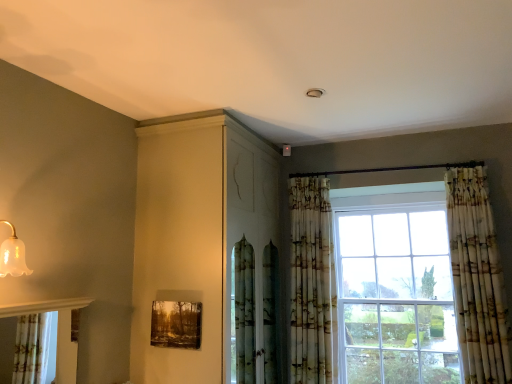
Question: Considering the relative positions of wooden textured frame at lower center and printed fabric curtain at right, which is the 2th curtain in left-to-right order, in the image provided, is wooden textured frame at lower center to the left of printed fabric curtain at right, which is the 2th curtain in left-to-right order, from the viewer's perspective?

Choices:
 (A) yes
 (B) no

Answer: (A)

Question: Is wooden textured frame at lower center placed right next to printed fabric curtain at right, which is the 2th curtain in left-to-right order?

Choices:
 (A) yes
 (B) no

Answer: (B)

Question: Does wooden textured frame at lower center have a larger size compared to printed fabric curtain at right, which is the 2th curtain in left-to-right order?

Choices:
 (A) no
 (B) yes

Answer: (A)

Question: Is wooden textured frame at lower center not near printed fabric curtain at right, positioned as the first curtain in right-to-left order?

Choices:
 (A) yes
 (B) no

Answer: (A)

Question: Is wooden textured frame at lower center at the right side of printed fabric curtain at right, positioned as the first curtain in right-to-left order?

Choices:
 (A) no
 (B) yes

Answer: (A)

Question: Is printed fabric curtain at center, the 1th curtain positioned from the left, situated inside wooden textured frame at lower center or outside?

Choices:
 (A) inside
 (B) outside

Answer: (B)

Question: In the image, is printed fabric curtain at center, the 1th curtain positioned from the left, positioned in front of or behind wooden textured frame at lower center?

Choices:
 (A) front
 (B) behind

Answer: (B)

Question: Considering the relative positions of printed fabric curtain at center, the second curtain positioned from the right, and wooden textured frame at lower center in the image provided, is printed fabric curtain at center, the second curtain positioned from the right, to the left or to the right of wooden textured frame at lower center?

Choices:
 (A) right
 (B) left

Answer: (A)

Question: From the image's perspective, is printed fabric curtain at center, the 1th curtain positioned from the left, located above or below wooden textured frame at lower center?

Choices:
 (A) below
 (B) above

Answer: (B)

Question: Is printed fabric curtain at center, the 1th curtain positioned from the left, inside the boundaries of printed fabric curtain at right, which is the 2th curtain in left-to-right order, or outside?

Choices:
 (A) inside
 (B) outside

Answer: (B)

Question: Considering the positions of printed fabric curtain at center, the 1th curtain positioned from the left, and printed fabric curtain at right, positioned as the first curtain in right-to-left order, in the image, is printed fabric curtain at center, the 1th curtain positioned from the left, wider or thinner than printed fabric curtain at right, positioned as the first curtain in right-to-left order,?

Choices:
 (A) thin
 (B) wide

Answer: (A)

Question: From a real-world perspective, is printed fabric curtain at center, the 1th curtain positioned from the left, physically located above or below printed fabric curtain at right, positioned as the first curtain in right-to-left order?

Choices:
 (A) below
 (B) above

Answer: (A)

Question: From the image's perspective, is printed fabric curtain at center, the 1th curtain positioned from the left, above or below printed fabric curtain at right, which is the 2th curtain in left-to-right order?

Choices:
 (A) below
 (B) above

Answer: (A)

Question: Considering the positions of wooden textured frame at lower center and matte white cabinet at upper center in the image, is wooden textured frame at lower center taller or shorter than matte white cabinet at upper center?

Choices:
 (A) tall
 (B) short

Answer: (B)

Question: Is point (160, 339) positioned closer to the camera than point (207, 367)?

Choices:
 (A) closer
 (B) farther

Answer: (B)